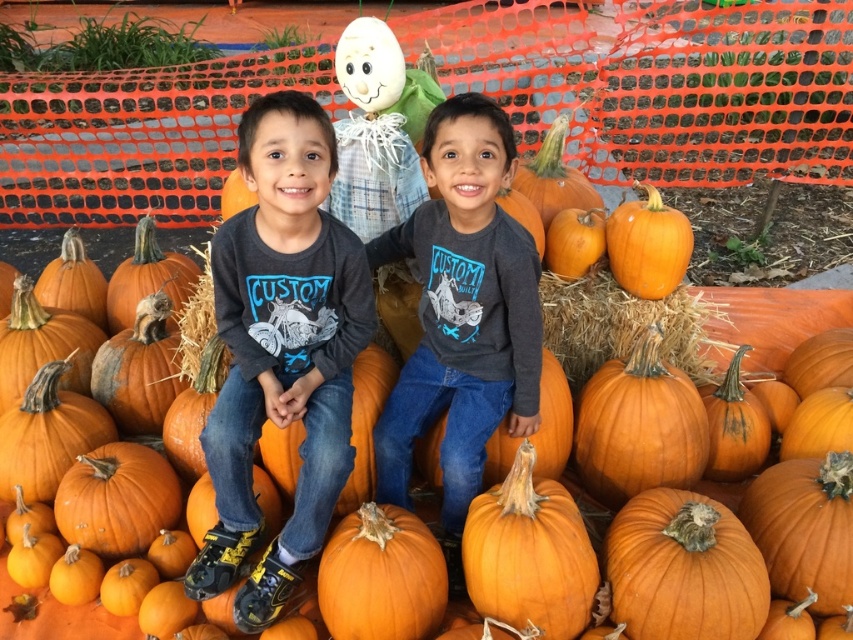
Between point (473, 100) and point (90, 618), which one is positioned behind?

The point (90, 618) is more distant.

Does point (444, 401) come in front of point (4, 552)?

Yes.

The image size is (853, 640). I want to click on dark gray cotton shirt at center, so click(462, 316).

Which of these two, dark gray cotton shirt at center or orange matte pumpkin at right, stands shorter?

With less height is orange matte pumpkin at right.

Who is more forward, (506, 132) or (607, 253)?

Point (506, 132) is more forward.

The height and width of the screenshot is (640, 853). I want to click on dark gray cotton shirt at center, so click(x=462, y=316).

Between orange matte pumpkin at center and orange matte pumpkin at right, which one has less height?

With less height is orange matte pumpkin at center.

Who is positioned more to the left, orange matte pumpkin at center or orange matte pumpkin at right?

orange matte pumpkin at right is more to the left.

Is point (740, 339) farther from camera compared to point (637, 208)?

Yes.

Where is `orange matte pumpkin at center`? This screenshot has width=853, height=640. orange matte pumpkin at center is located at coordinates (772, 320).